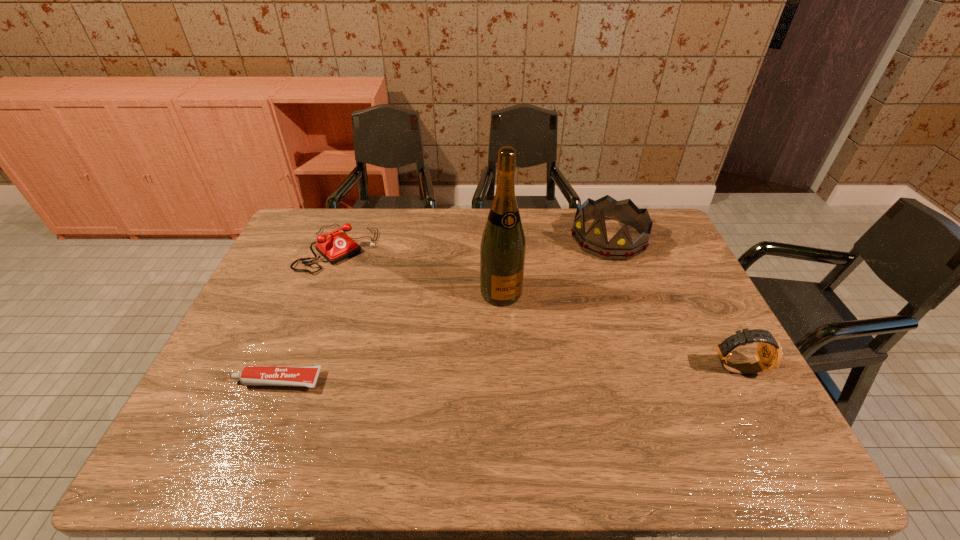
This screenshot has height=540, width=960. I want to click on free space on the desktop that is between the shortest object and the third shortest object and is positioned on the front-facing side of the third farthest object, so click(544, 373).

Locate an element on the screen. Image resolution: width=960 pixels, height=540 pixels. free spot on the desktop that is between the toothpaste and the watch and is positioned at the front of the second object from right to left with jewels is located at coordinates (484, 375).

Locate an element on the screen. This screenshot has width=960, height=540. vacant space on the desktop that is between the toothpaste and the third shortest object and is positioned on the dial of the second shortest object is located at coordinates (481, 375).